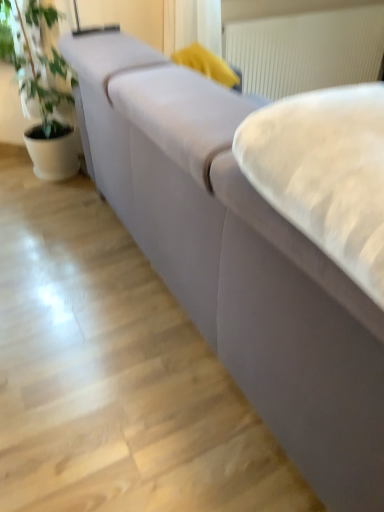
What do you see at coordinates (325, 173) in the screenshot? I see `white soft cushion at center` at bounding box center [325, 173].

In order to face white soft cushion at center, should I rotate leftwards or rightwards?

To align with it, rotate right about 23.867°.

The height and width of the screenshot is (512, 384). In order to click on white soft cushion at center in this screenshot , I will do `click(325, 173)`.

The width and height of the screenshot is (384, 512). Identify the location of white textured radiator at upper center. (306, 50).

Image resolution: width=384 pixels, height=512 pixels. Describe the element at coordinates (306, 50) in the screenshot. I see `white textured radiator at upper center` at that location.

Where is `white soft cushion at center`? This screenshot has height=512, width=384. white soft cushion at center is located at coordinates (325, 173).

Based on the photo, based on their positions, is white soft cushion at center located to the left or right of white textured radiator at upper center?

In the image, white soft cushion at center appears on the left side of white textured radiator at upper center.

Between white soft cushion at center and white textured radiator at upper center, which one is positioned in front?

white soft cushion at center.

Which is behind, point (342, 100) or point (230, 33)?

Positioned behind is point (230, 33).

From the image's perspective, does white soft cushion at center appear lower than white textured radiator at upper center?

Yes, from the image's perspective, white soft cushion at center is beneath white textured radiator at upper center.

From a real-world perspective, is white soft cushion at center physically above white textured radiator at upper center?

Yes, from a real-world perspective, white soft cushion at center is on top of white textured radiator at upper center.

Is white soft cushion at center thinner than white textured radiator at upper center?

No.

Can you confirm if white soft cushion at center is shorter than white textured radiator at upper center?

Yes.

Considering the sizes of objects white soft cushion at center and white textured radiator at upper center in the image provided, who is smaller, white soft cushion at center or white textured radiator at upper center?

white soft cushion at center is smaller.

Would you say white soft cushion at center is outside white textured radiator at upper center?

white soft cushion at center is positioned outside white textured radiator at upper center.

From the picture: Can you see white soft cushion at center touching white textured radiator at upper center?

white soft cushion at center is not next to white textured radiator at upper center, and they're not touching.

Could you tell me if white soft cushion at center is facing white textured radiator at upper center?

No, white soft cushion at center does not turn towards white textured radiator at upper center.

Locate an element on the screen. sheet below the white textured radiator at upper center (from the image's perspective) is located at coordinates (325, 173).

Considering the relative positions of white textured radiator at upper center and white soft cushion at center in the image provided, is white textured radiator at upper center to the left of white soft cushion at center from the viewer's perspective?

No.

Is white textured radiator at upper center in front of white soft cushion at center?

No.

Does point (315, 42) appear closer or farther from the camera than point (307, 201)?

Point (315, 42).

From the image's perspective, is white textured radiator at upper center below white soft cushion at center?

Actually, white textured radiator at upper center appears above white soft cushion at center in the image.

From a real-world perspective, is white textured radiator at upper center physically above white soft cushion at center?

No.

Looking at their sizes, would you say white textured radiator at upper center is wider or thinner than white soft cushion at center?

Considering their sizes, white textured radiator at upper center looks slimmer than white soft cushion at center.

Between white textured radiator at upper center and white soft cushion at center, which one has more height?

With more height is white textured radiator at upper center.

In terms of size, does white textured radiator at upper center appear bigger or smaller than white soft cushion at center?

Clearly, white textured radiator at upper center is larger in size than white soft cushion at center.

Is white textured radiator at upper center inside the boundaries of white soft cushion at center, or outside?

white textured radiator at upper center is not enclosed by white soft cushion at center.

Is white textured radiator at upper center far away from white soft cushion at center?

Indeed, white textured radiator at upper center is not near white soft cushion at center.

Is white textured radiator at upper center facing away from white soft cushion at center?

No.

From the picture: How many degrees apart are the facing directions of white textured radiator at upper center and white soft cushion at center?

The angular difference between white textured radiator at upper center and white soft cushion at center is 89.8 degrees.

The image size is (384, 512). I want to click on radiator behind the white soft cushion at center, so click(x=306, y=50).

The width and height of the screenshot is (384, 512). Find the location of `sheet above the white textured radiator at upper center (from a real-world perspective)`. sheet above the white textured radiator at upper center (from a real-world perspective) is located at coordinates (325, 173).

The width and height of the screenshot is (384, 512). Identify the location of sheet in front of the white textured radiator at upper center. (325, 173).